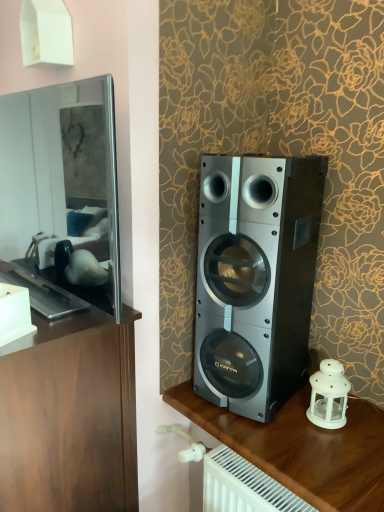
Find the location of a particular element. The width and height of the screenshot is (384, 512). free area in between silver metallic speaker at center and white matte lantern at lower right is located at coordinates (293, 412).